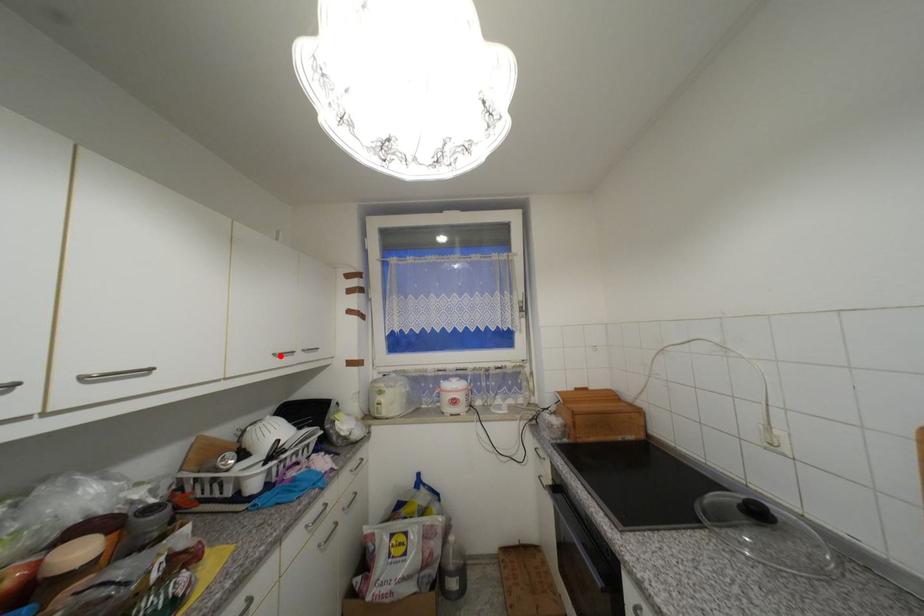
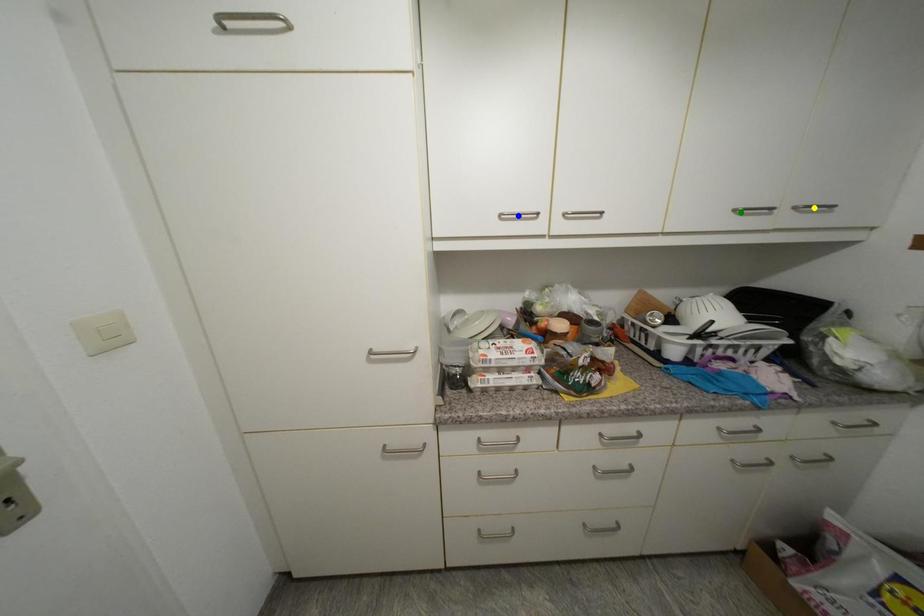
Question: I am providing you with two images of the same scene from different viewpoints. A red point is marked on the first image. You are given multiple points on the second image. Which point in image 2 is actually the same real-world point as the red point in image 1?

Choices:
 (A) yellow point
 (B) blue point
 (C) green point

Answer: (C)